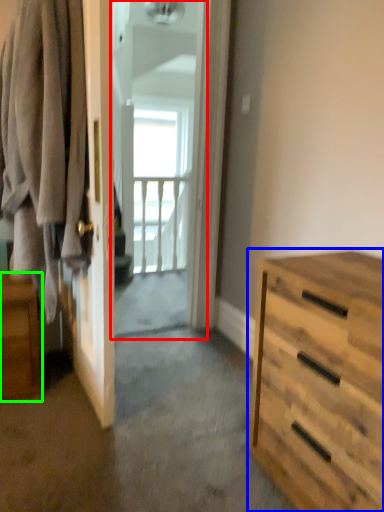
Question: Considering the real-world distances, which object is closest to screen door (highlighted by a red box)? chest of drawers (highlighted by a blue box) or nightstand (highlighted by a green box).

Choices:
 (A) chest of drawers
 (B) nightstand

Answer: (B)